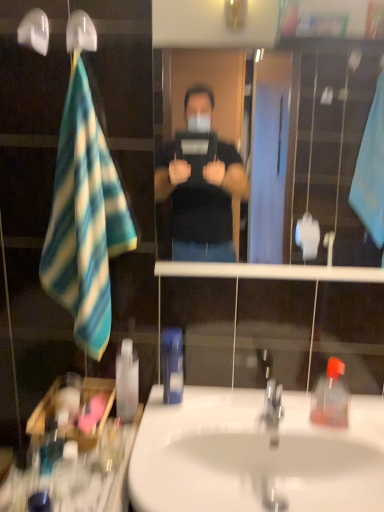
Where is `vacant area that is situated to the right of translucent plastic mouthwash at lower left, the third mouthwash positioned from the back`? vacant area that is situated to the right of translucent plastic mouthwash at lower left, the third mouthwash positioned from the back is located at coordinates (107, 490).